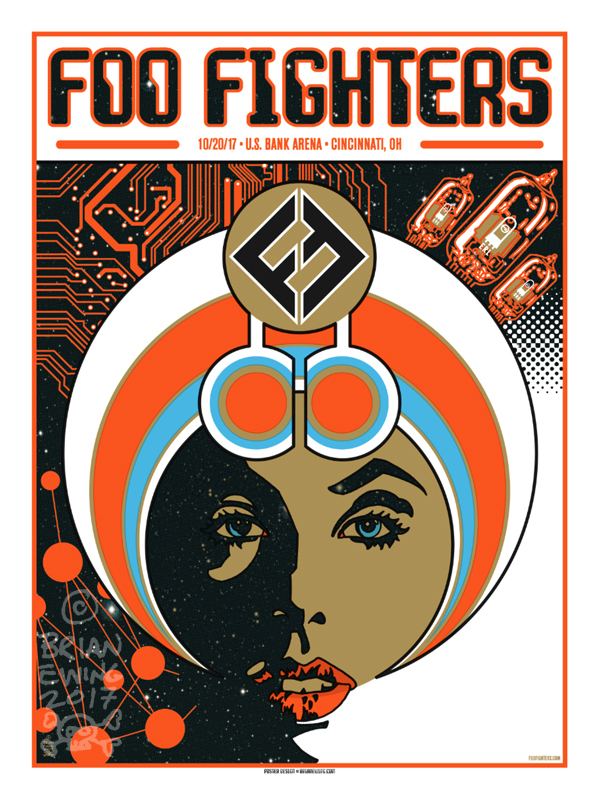
I want to click on poster, so click(x=468, y=686).